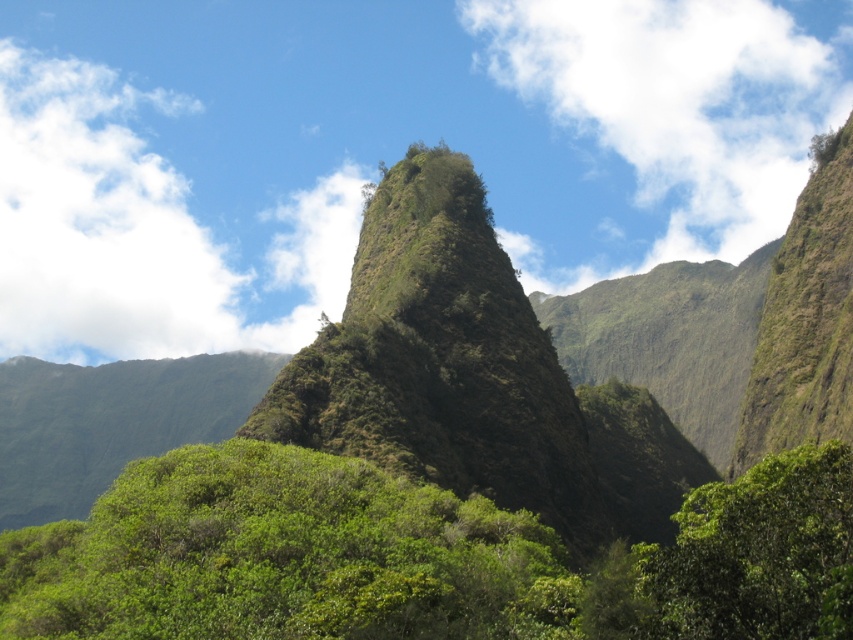
Who is more distant from viewer, (x=117, y=419) or (x=842, y=540)?

The point (x=117, y=419) is more distant.

Between green rocky mountain at center and green leafy tree at center, which one has more height?

With more height is green rocky mountain at center.

Is point (387, 376) positioned before point (770, 525)?

No, (387, 376) is behind (770, 525).

Locate an element on the screen. This screenshot has height=640, width=853. green rocky mountain at center is located at coordinates (488, 369).

At what (x,y) coordinates should I click in order to perform the action: click on green rocky mountain at center. Please return your answer as a coordinate pair (x, y). Image resolution: width=853 pixels, height=640 pixels. Looking at the image, I should click on (488, 369).

In the scene shown: Who is positioned more to the left, green rocky mountain at center or green leafy tree at lower right?

From the viewer's perspective, green rocky mountain at center appears more on the left side.

Measure the distance between green rocky mountain at center and camera.

They are 87.75 meters apart.

The height and width of the screenshot is (640, 853). In order to click on green rocky mountain at center in this screenshot , I will do `click(488, 369)`.

Can you confirm if green leafy tree at center is positioned to the right of green leafy tree at lower right?

No, green leafy tree at center is not to the right of green leafy tree at lower right.

Does point (788, 451) come behind point (796, 449)?

Yes, point (788, 451) is farther from viewer.

Image resolution: width=853 pixels, height=640 pixels. Describe the element at coordinates (421, 557) in the screenshot. I see `green leafy tree at center` at that location.

This screenshot has width=853, height=640. I want to click on green leafy tree at center, so click(x=421, y=557).